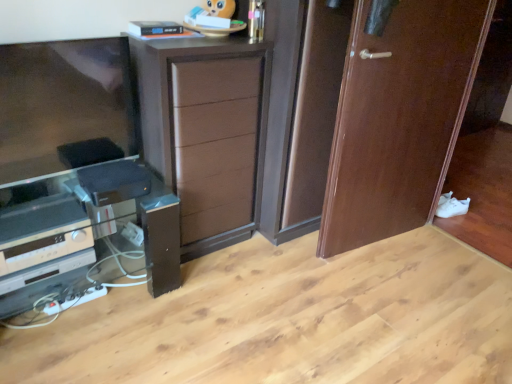
I want to click on free region under black glossy speaker at lower left (from a real-world perspective), so click(78, 311).